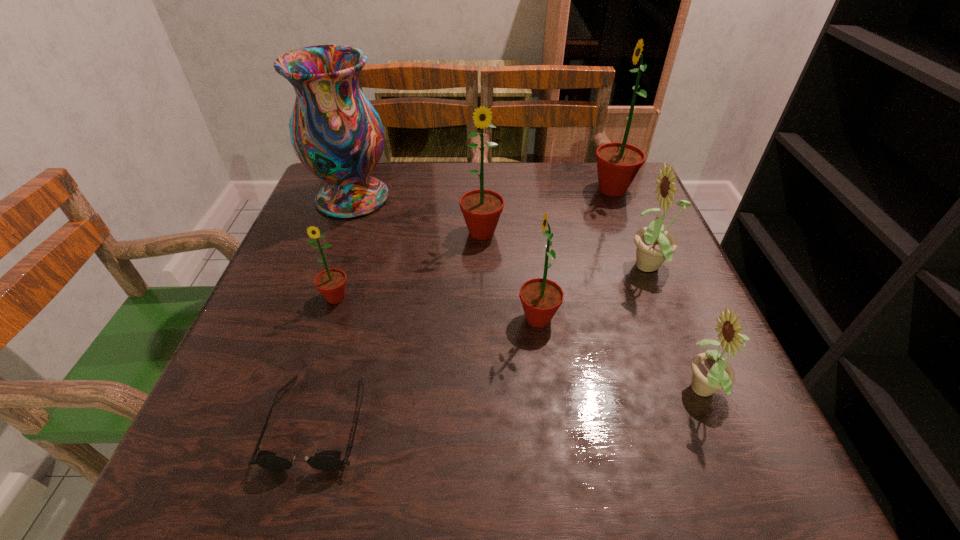
The height and width of the screenshot is (540, 960). Identify the location of the smallest green sunflower. (331, 283).

Locate an element on the screen. This screenshot has width=960, height=540. the leftmost green sunflower is located at coordinates (331, 283).

The width and height of the screenshot is (960, 540). I want to click on sunglasses, so click(329, 460).

What are the coordinates of `blank area located 0.360m on the face of the rightmost green sunflower` in the screenshot? It's located at (449, 190).

Locate an element on the screen. The width and height of the screenshot is (960, 540). free space located on the face of the rightmost green sunflower is located at coordinates (434, 190).

Where is `vacant space located 0.130m on the face of the rightmost green sunflower`? Image resolution: width=960 pixels, height=540 pixels. vacant space located 0.130m on the face of the rightmost green sunflower is located at coordinates (539, 190).

Where is `free region located 0.170m on the right of the vase`? free region located 0.170m on the right of the vase is located at coordinates (461, 198).

Image resolution: width=960 pixels, height=540 pixels. Find the location of `vacant space situated 0.310m on the face of the fifth nearest sunflower`. vacant space situated 0.310m on the face of the fifth nearest sunflower is located at coordinates (482, 363).

Where is `vacant space situated 0.140m on the front-facing side of the farther yellow sunflower`? vacant space situated 0.140m on the front-facing side of the farther yellow sunflower is located at coordinates (556, 268).

The image size is (960, 540). What are the coordinates of `vacant area located on the front-facing side of the farther yellow sunflower` in the screenshot? It's located at (436, 268).